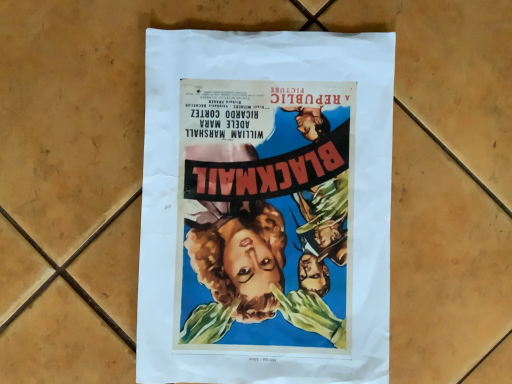
What do you see at coordinates (265, 207) in the screenshot?
I see `matte paper poster at center` at bounding box center [265, 207].

Image resolution: width=512 pixels, height=384 pixels. In order to click on matte paper poster at center in this screenshot , I will do `click(265, 207)`.

In order to face matte paper poster at center, should I rotate leftwards or rightwards?

You should rotate right by 1.783 degrees.

I want to click on matte paper poster at center, so coord(265,207).